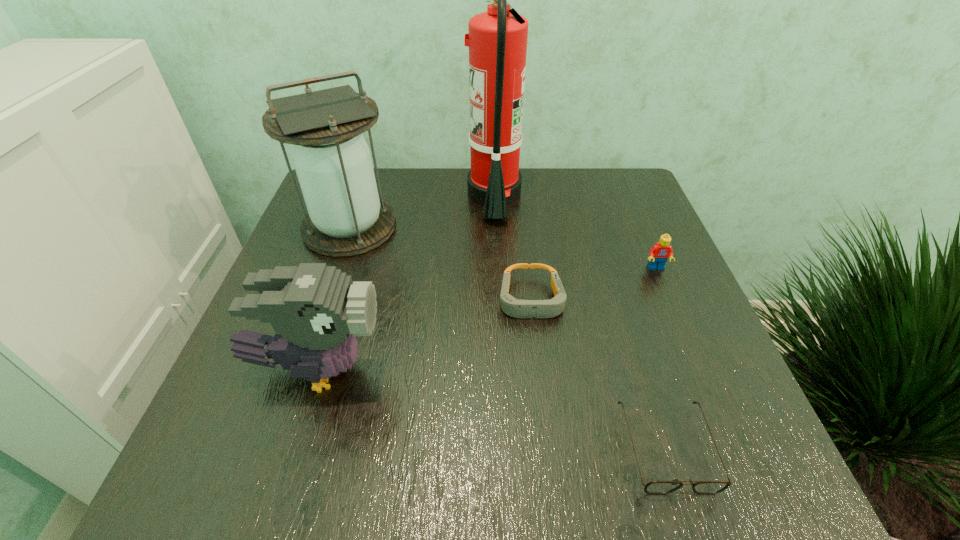
You are a GUI agent. You are given a task and a screenshot of the screen. Output one action in this format:
    pyautogui.click(x=<x>, y=<y>)
    Task: Click on the fire extinguisher
    This screenshot has width=960, height=540.
    Given the screenshot: What is the action you would take?
    pyautogui.click(x=497, y=39)

The height and width of the screenshot is (540, 960). I want to click on lantern, so click(x=332, y=160).

Locate an element on the screen. This screenshot has width=960, height=540. the second nearest object is located at coordinates (316, 311).

Identify the location of bird. The width and height of the screenshot is (960, 540). (316, 311).

Locate an element on the screen. the third shortest object is located at coordinates (659, 253).

The height and width of the screenshot is (540, 960). Find the location of `the third farthest object`. the third farthest object is located at coordinates (659, 253).

This screenshot has height=540, width=960. What are the coordinates of `the third nearest object` in the screenshot? It's located at (511, 306).

Find the location of `the nearest object`. the nearest object is located at coordinates (654, 487).

At what (x,y) coordinates should I click in order to perform the action: click on sunglasses. Please return your answer as a coordinate pair (x, y). The image size is (960, 540). Looking at the image, I should click on (654, 487).

The width and height of the screenshot is (960, 540). I want to click on vacant space located at the nozzle of the fire extinguisher, so click(348, 195).